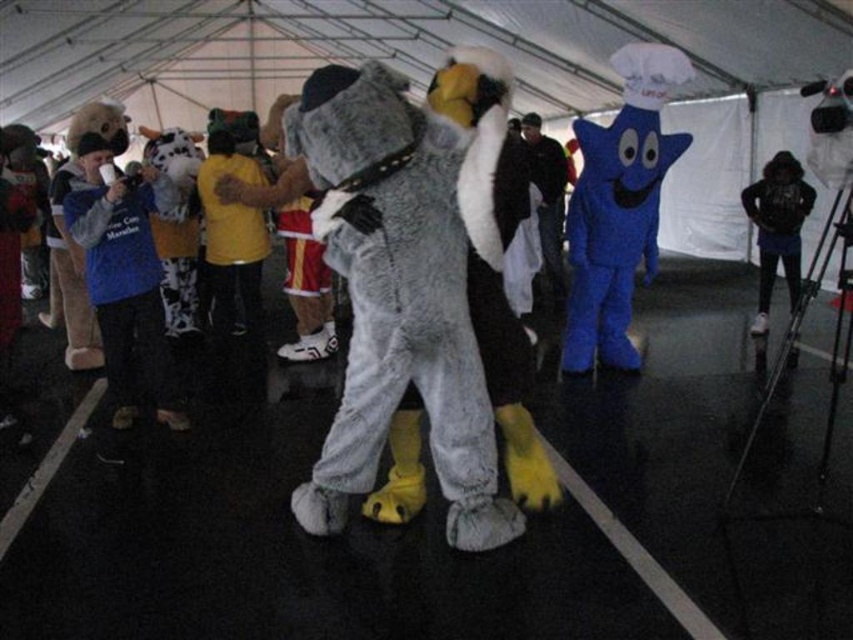
Consider the image. You are a photographer at the event and need to capture a photo that includes both the blue plush star at center and the blue fleece jacket at left. Considering their sizes, which object should you position closer to the camera to ensure both appear in the frame without cropping?

The blue plush star at center is much taller than the blue fleece jacket at left. To include both in the frame without cropping, position the blue plush star at center closer to the camera since its larger size requires more space in the photo.

You are a photographer setting up a tripod in the center of the tent. You want to take a photo of the blue plush star at center and the black backpack at right without any obstructions. Given their sizes, which object might block the view of the other?

The blue plush star at center is much taller than the black backpack at right, so it could potentially block the view of the black backpack at right if positioned between the camera and the backpack.

You are organizing a costume party and need to arrange the blue plush star at center and the blue fleece jacket at left in a way that highlights their sizes. Which object should be placed in a more prominent position to emphasize its size difference?

The blue plush star at center should be placed in a more prominent position because it is bigger than the blue fleece jacket at left, making the size difference more noticeable.